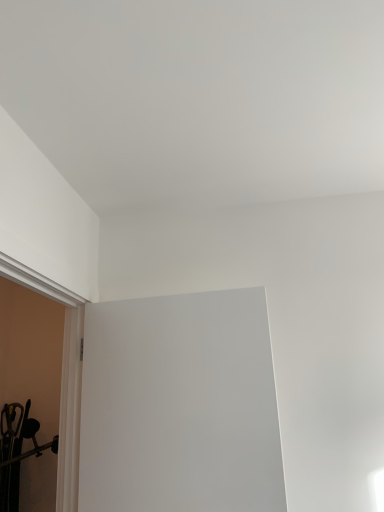
Question: From the image's perspective, is white matte door at center positioned above or below white smooth door frame at left?

Choices:
 (A) below
 (B) above

Answer: (A)

Question: Is white matte door at center spatially inside white smooth door frame at left, or outside of it?

Choices:
 (A) inside
 (B) outside

Answer: (B)

Question: In the image, is white matte door at center positioned in front of or behind white smooth door frame at left?

Choices:
 (A) behind
 (B) front

Answer: (A)

Question: From their relative heights in the image, would you say white smooth door frame at left is taller or shorter than white matte door at center?

Choices:
 (A) short
 (B) tall

Answer: (B)

Question: Considering the positions of point (69, 482) and point (183, 318), is point (69, 482) closer or farther from the camera than point (183, 318)?

Choices:
 (A) closer
 (B) farther

Answer: (A)

Question: Considering the relative positions of white smooth door frame at left and white matte door at center in the image provided, is white smooth door frame at left to the left or to the right of white matte door at center?

Choices:
 (A) right
 (B) left

Answer: (B)

Question: Based on their sizes in the image, would you say white smooth door frame at left is bigger or smaller than white matte door at center?

Choices:
 (A) big
 (B) small

Answer: (A)